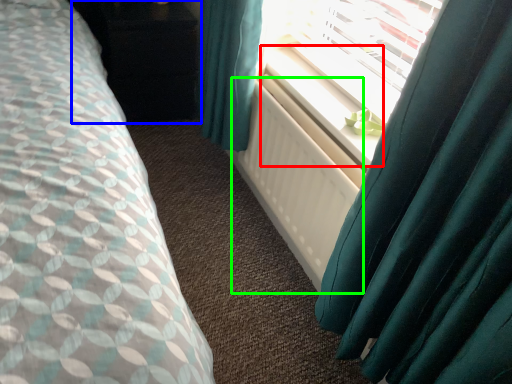
Question: Estimate the real-world distances between objects in this image. Which object is farther from window sill (highlighted by a red box), dresser (highlighted by a blue box) or radiator (highlighted by a green box)?

Choices:
 (A) dresser
 (B) radiator

Answer: (A)